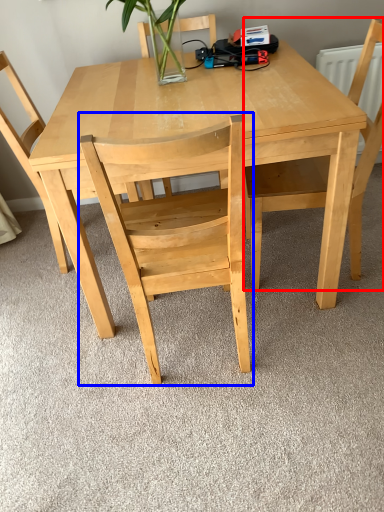
Question: Which of the following is the farthest to the observer, chair (highlighted by a red box) or chair (highlighted by a blue box)?

Choices:
 (A) chair
 (B) chair

Answer: (A)